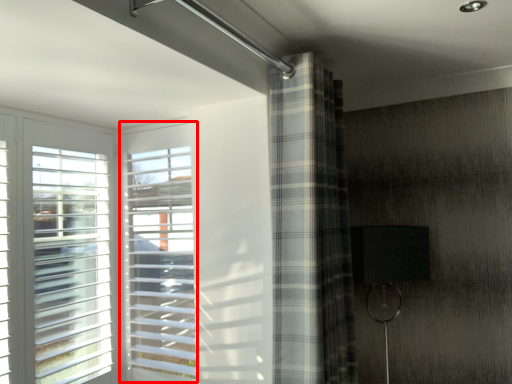
Question: From the image's perspective, what is the correct spatial relationship of window (annotated by the red box) in relation to curtain?

Choices:
 (A) above
 (B) below

Answer: (B)